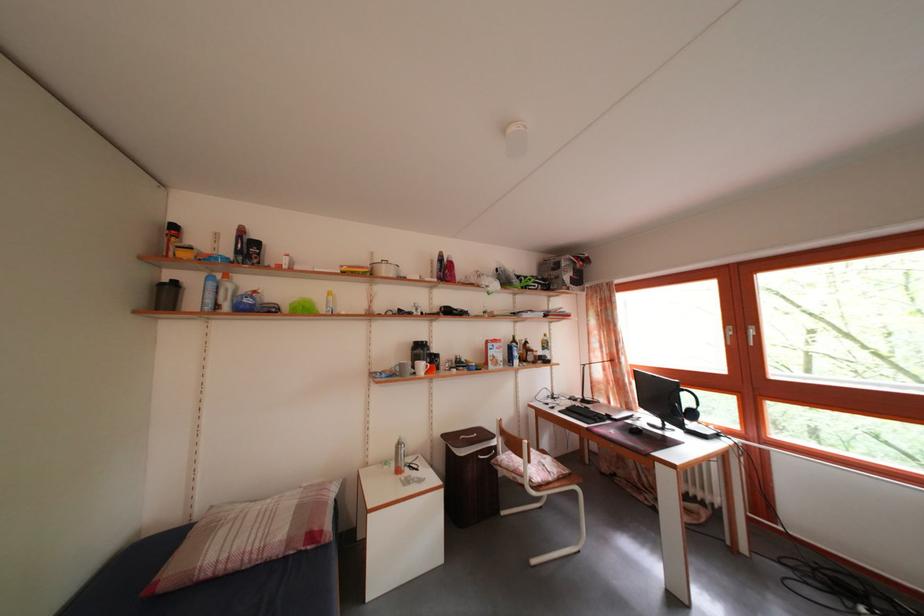
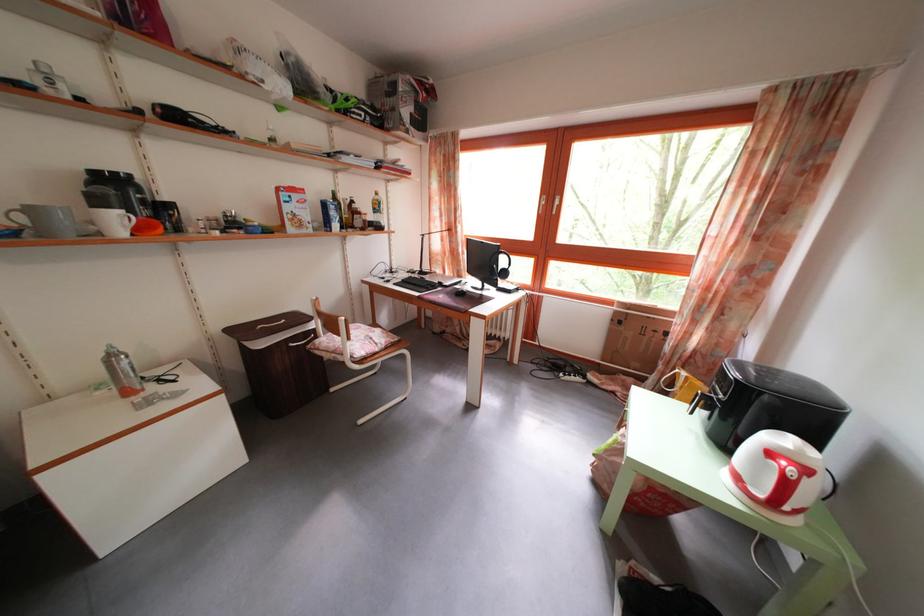
Locate, in the second image, the point that corresponds to point 623,428 in the first image.

(454, 294)